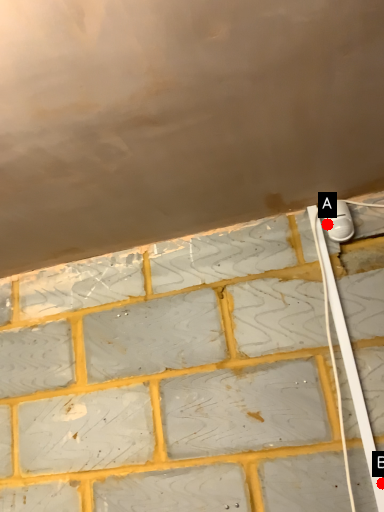
Question: Two points are circled on the image, labeled by A and B beside each circle. Which point is further to the camera?

Choices:
 (A) A is further
 (B) B is further

Answer: (A)